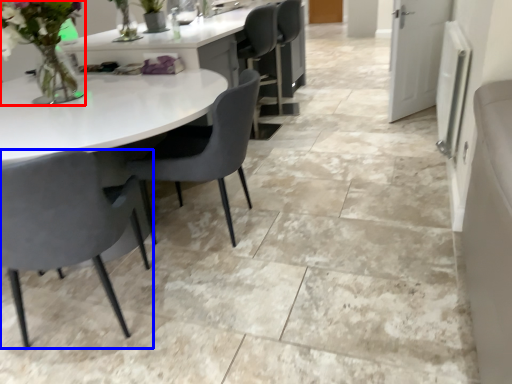
Question: Which point is closer to the camera, floral arrangement (highlighted by a red box) or chair (highlighted by a blue box)?

Choices:
 (A) floral arrangement
 (B) chair

Answer: (B)